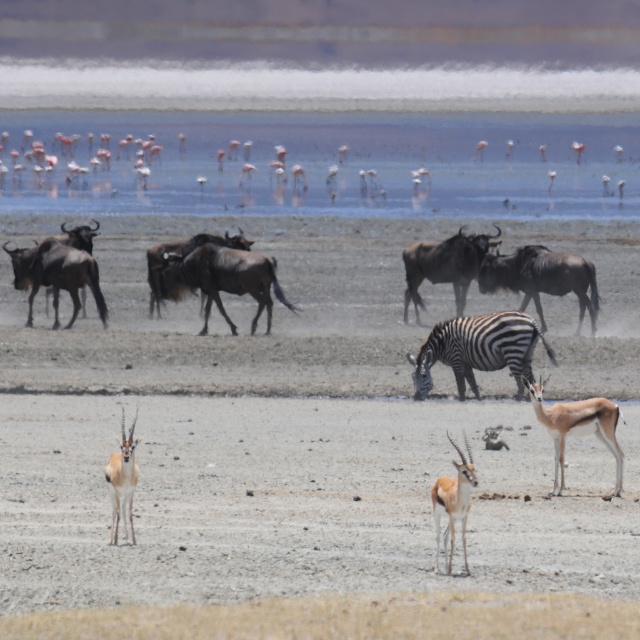
Question: Can you confirm if black and white striped zebra at center is smaller than shiny brown antelope at center?

Choices:
 (A) no
 (B) yes

Answer: (A)

Question: Which object is the closest to the light brown fur antelope at lower center?

Choices:
 (A) brown glossy antelope at center
 (B) gray sandy dirt field at center
 (C) shiny brown antelope at center

Answer: (A)

Question: Which point appears closest to the camera in this image?

Choices:
 (A) (593, 404)
 (B) (134, 480)

Answer: (B)

Question: Is black and white striped zebra at center closer to the viewer compared to light brown fur antelope at lower center?

Choices:
 (A) yes
 (B) no

Answer: (B)

Question: Among these objects, which one is nearest to the camera?

Choices:
 (A) black and white striped zebra at center
 (B) brown glossy antelope at center

Answer: (B)

Question: Is black and white striped zebra at center to the right of brown glossy antelope at center from the viewer's perspective?

Choices:
 (A) no
 (B) yes

Answer: (B)